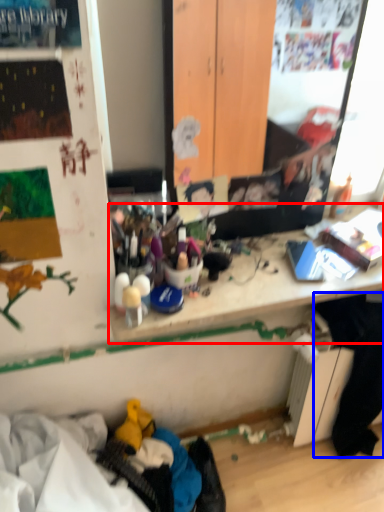
Question: Which object is further to the camera taking this photo, writing desk (highlighted by a red box) or clothing (highlighted by a blue box)?

Choices:
 (A) writing desk
 (B) clothing

Answer: (B)